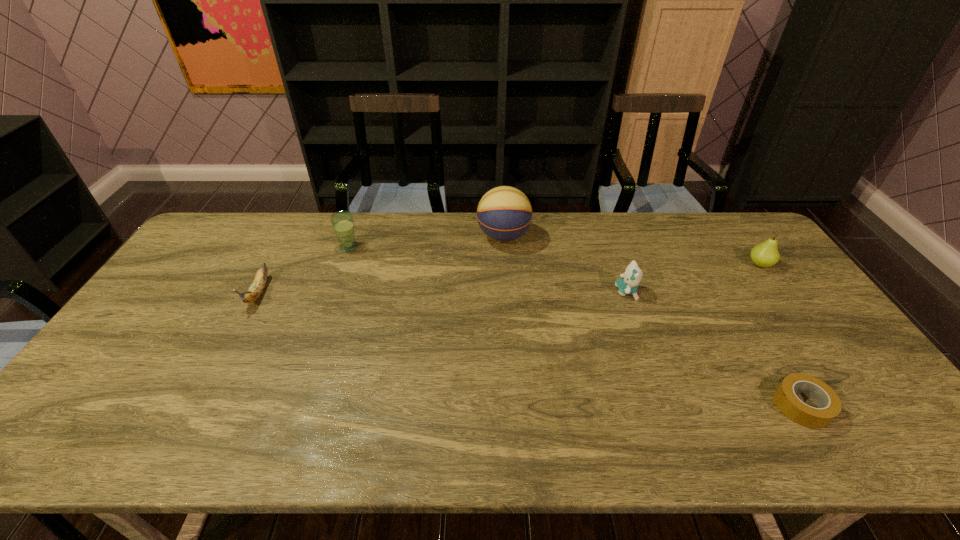
The height and width of the screenshot is (540, 960). I want to click on the third object from left to right, so click(504, 214).

Locate an element on the screen. The height and width of the screenshot is (540, 960). basketball is located at coordinates (504, 214).

Where is `the fifth object from right to left`? This screenshot has height=540, width=960. the fifth object from right to left is located at coordinates (342, 222).

Find the location of `the rightmost object`. the rightmost object is located at coordinates pos(766,254).

Find the location of `pear`. pear is located at coordinates (766, 254).

The image size is (960, 540). I want to click on kitten, so click(x=628, y=284).

I want to click on banana, so click(254, 292).

The width and height of the screenshot is (960, 540). Find the location of `the fifth object from left to right`. the fifth object from left to right is located at coordinates (829, 405).

Where is `the nearest object`? Image resolution: width=960 pixels, height=540 pixels. the nearest object is located at coordinates (829, 405).

This screenshot has height=540, width=960. In order to click on vacant area situated 0.050m on the patterned surface of the fourth object from right to left in this screenshot , I will do [x=463, y=237].